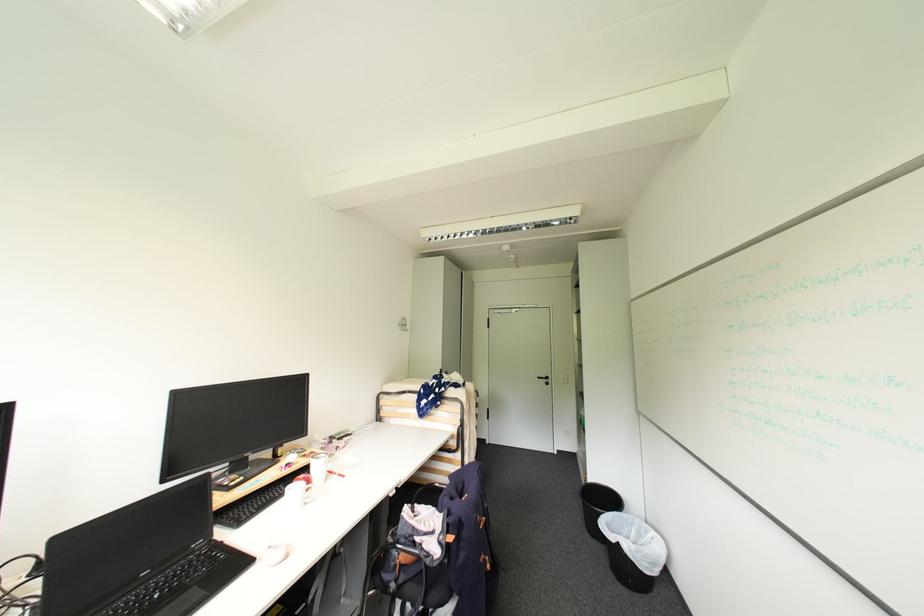
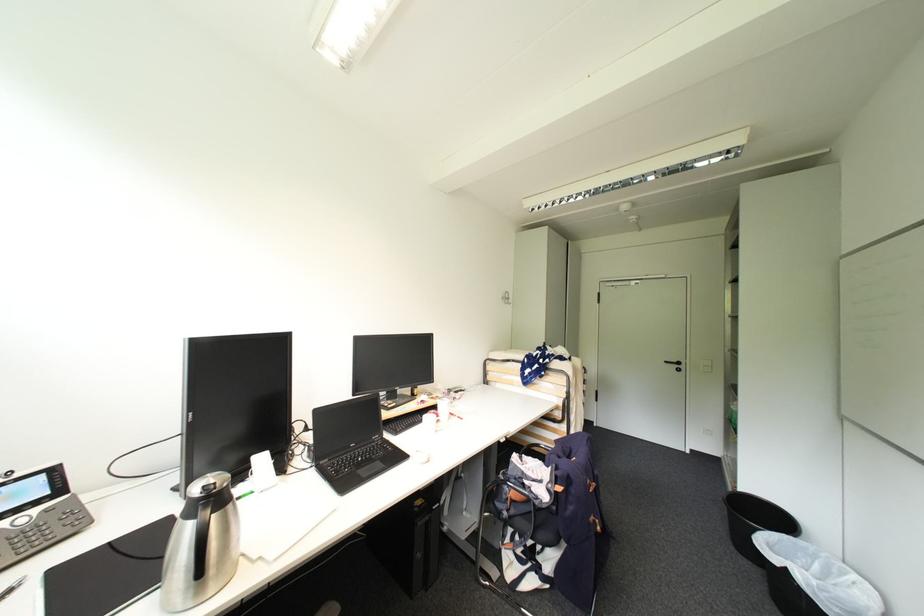
The images are taken continuously from a first-person perspective. In which direction are you moving?

The movement direction of the cameraman is left, backward.